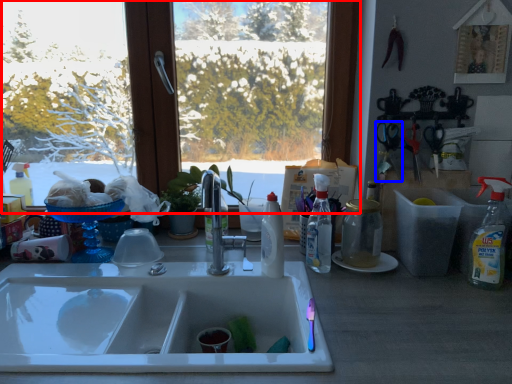
Question: Which of the following is the farthest to the observer, window (highlighted by a red box) or scissors (highlighted by a blue box)?

Choices:
 (A) window
 (B) scissors

Answer: (A)